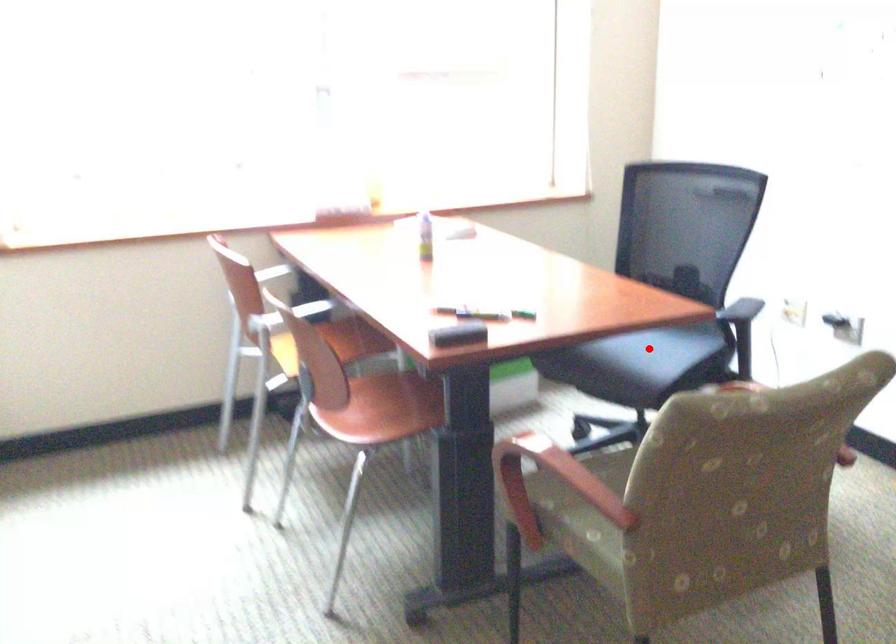
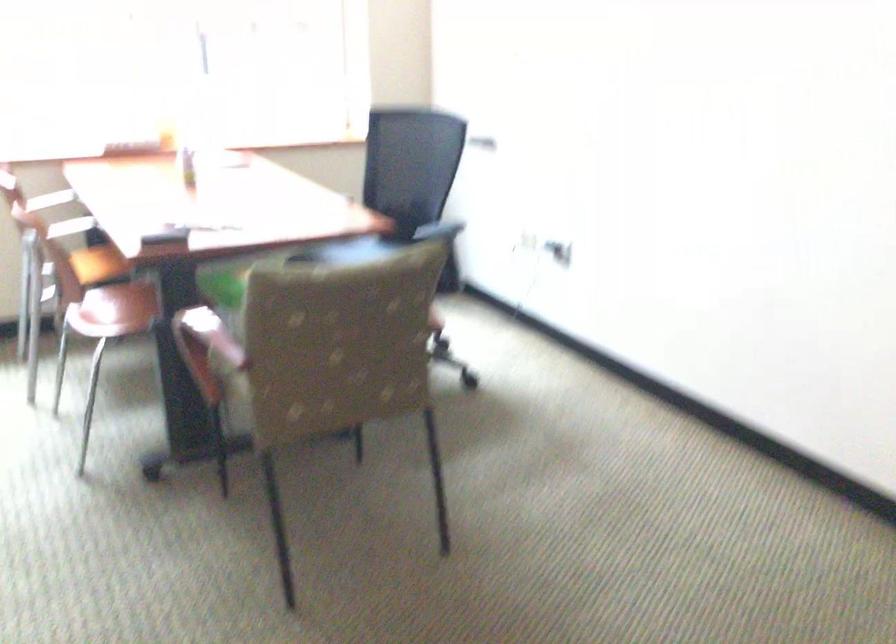
Question: I am providing you with two images of the same scene from different viewpoints. A red point is marked on the first image. Can you still see the location of the red point in image 2?

Choices:
 (A) Yes
 (B) No

Answer: (B)